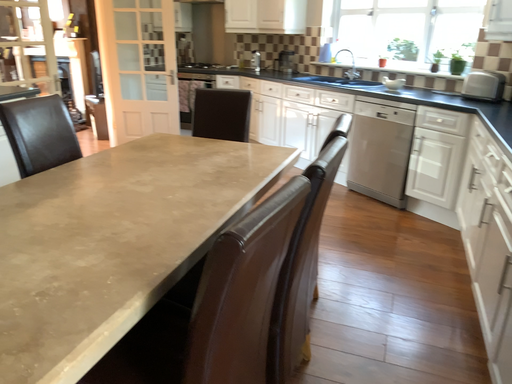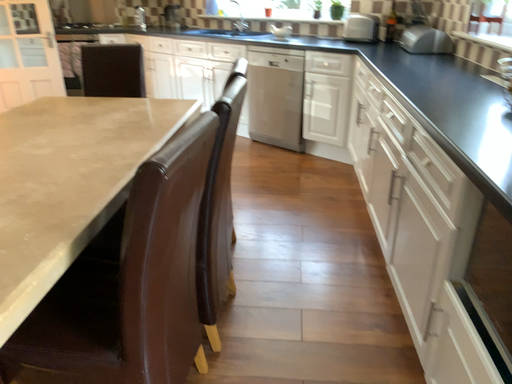
Question: Which way did the camera rotate in the video?

Choices:
 (A) rotated right
 (B) rotated left

Answer: (A)